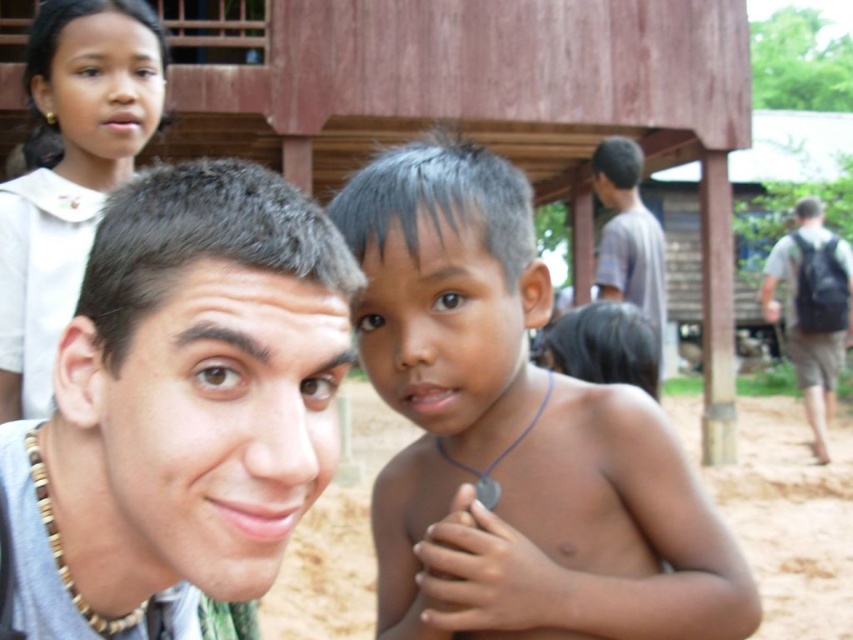
You are a photographer trying to capture a photo of the light brown hair at center and the black backpack at right. Which object is closer to the camera?

The light brown hair at center is closer to the camera than the black backpack at right because it is in front of it.